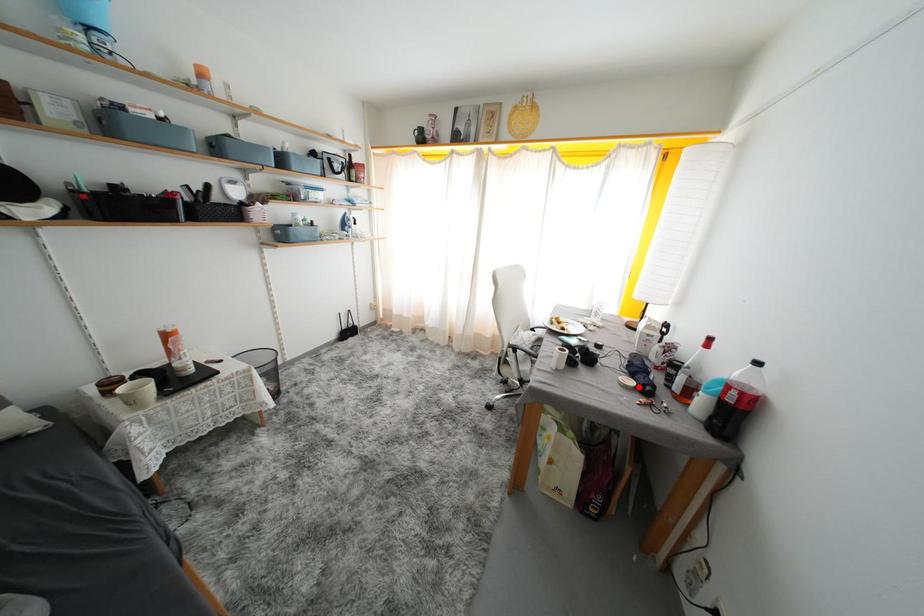
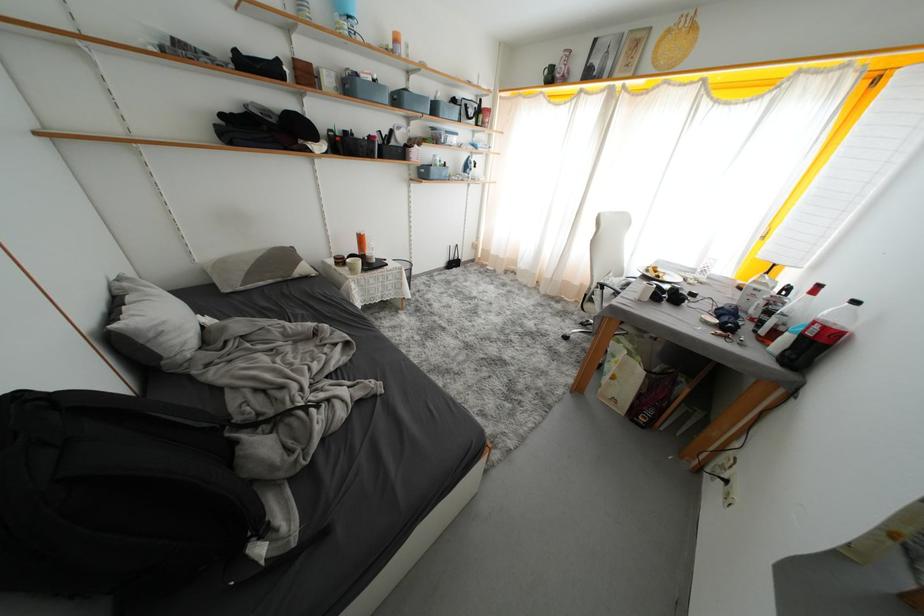
Locate, in the second image, the point that corresponds to the highlighted location in the first image.

(722, 325)